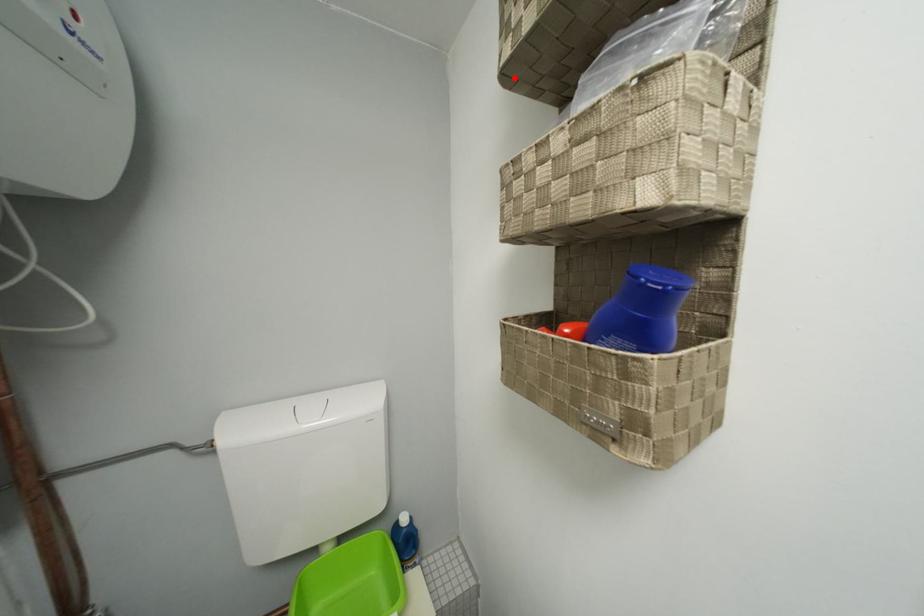
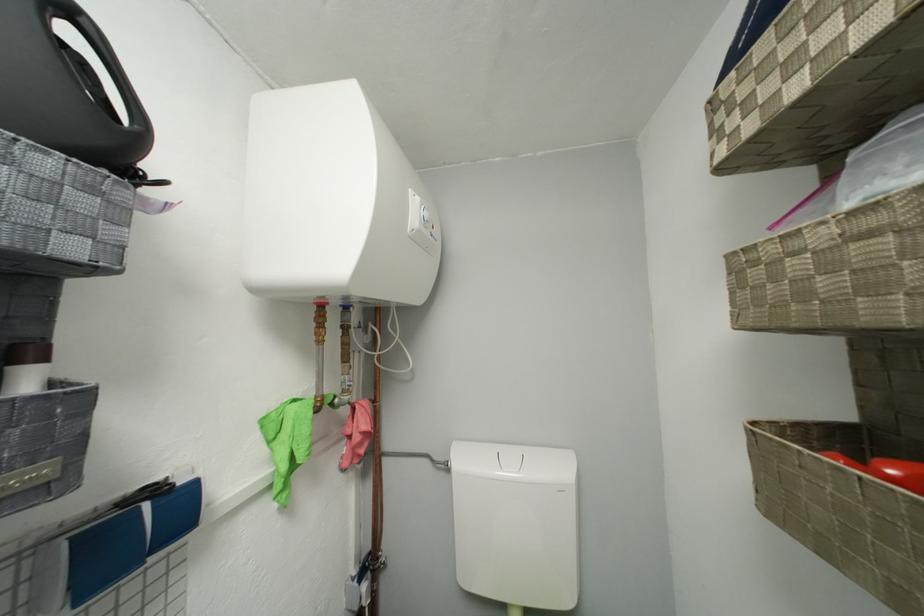
In the second image, find the point that corresponds to the highlighted location in the first image.

(732, 171)